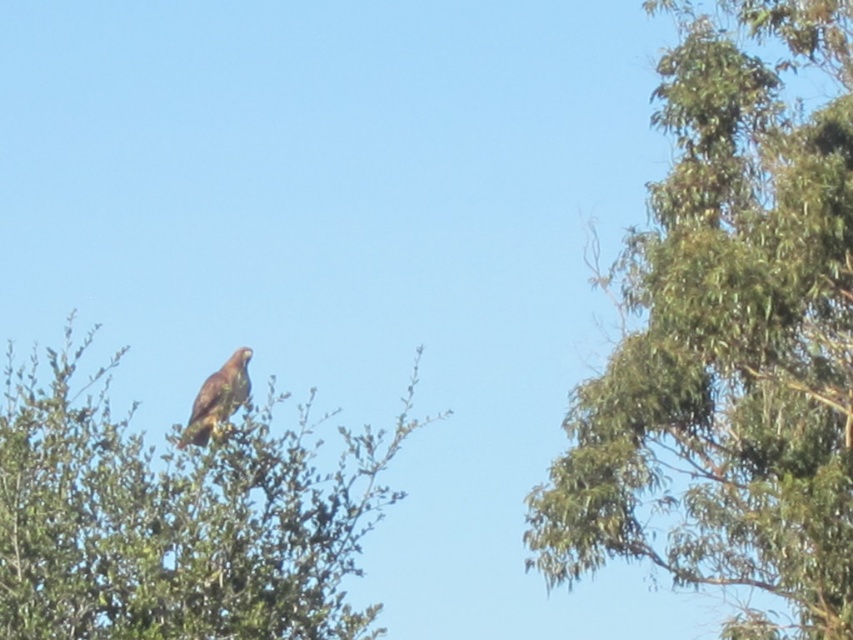
Question: Which point appears farthest from the camera in this image?

Choices:
 (A) (216, 420)
 (B) (715, 572)

Answer: (B)

Question: Which object is positioned closest to the green leafy tree at upper right?

Choices:
 (A) green leafy tree at upper left
 (B) brown feathered eagle at upper center

Answer: (B)

Question: Is green leafy tree at upper right positioned in front of green leafy tree at upper left?

Choices:
 (A) yes
 (B) no

Answer: (B)

Question: Can you confirm if green leafy tree at upper left is smaller than brown feathered eagle at upper center?

Choices:
 (A) no
 (B) yes

Answer: (B)

Question: Is green leafy tree at upper right closer to the viewer compared to brown feathered eagle at upper center?

Choices:
 (A) yes
 (B) no

Answer: (B)

Question: Estimate the real-world distances between objects in this image. Which object is closer to the brown feathered eagle at upper center?

Choices:
 (A) green leafy tree at upper left
 (B) green leafy tree at upper right

Answer: (A)